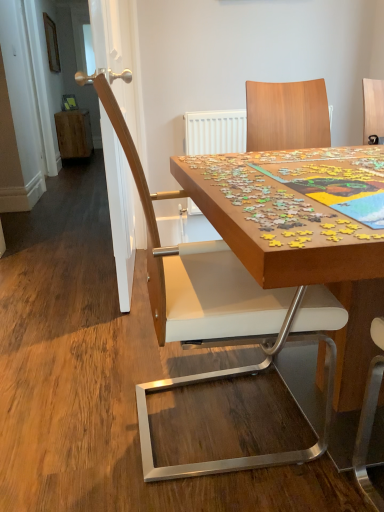
At what (x,y) coordinates should I click in order to perform the action: click on vacant region to the left of white leather chair at left. Please return your answer as a coordinate pair (x, y). This screenshot has width=384, height=512. Looking at the image, I should click on (76, 408).